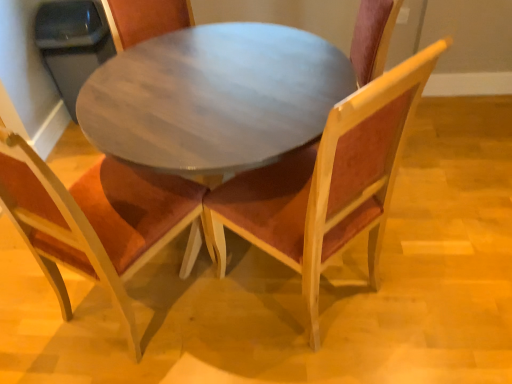
The width and height of the screenshot is (512, 384). In order to click on free space in front of velvet burgundy chair at center, placed as the second chair when sorted from left to right in this screenshot , I will do `click(315, 358)`.